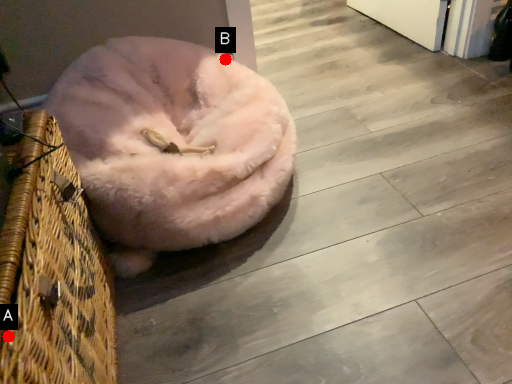
Question: Two points are circled on the image, labeled by A and B beside each circle. Which of the following is the farthest from the observer?

Choices:
 (A) A is further
 (B) B is further

Answer: (B)